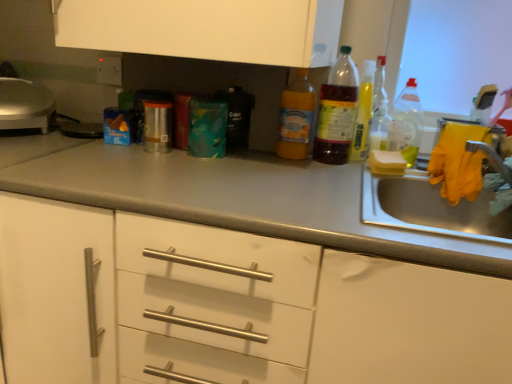
Describe the element at coordinates (362, 113) in the screenshot. This screenshot has height=384, width=512. I see `translucent plastic bottle at upper right, the third bottle in the left-to-right sequence` at that location.

I want to click on translucent plastic bottle at upper right, arranged as the third bottle when viewed from the right, so click(x=362, y=113).

This screenshot has width=512, height=384. Describe the element at coordinates (386, 163) in the screenshot. I see `white sponge at sink` at that location.

This screenshot has width=512, height=384. I want to click on gray matte countertop at center, so click(x=231, y=197).

What do you see at coordinates (25, 105) in the screenshot?
I see `shiny silver waffle maker at left` at bounding box center [25, 105].

What do you see at coordinates (379, 125) in the screenshot?
I see `translucent plastic bottle at right, the fourth bottle positioned from the left` at bounding box center [379, 125].

What is the approximate height of translucent plastic bottle at center, the 5th bottle in the right-to-left sequence?

translucent plastic bottle at center, the 5th bottle in the right-to-left sequence, is 9.66 inches tall.

This screenshot has height=384, width=512. Describe the element at coordinates (296, 118) in the screenshot. I see `translucent plastic bottle at center, placed as the 1th bottle when sorted from left to right` at that location.

How much space does translucent plastic bottle at center, the 2th bottle in the left-to-right sequence, occupy horizontally?

The width of translucent plastic bottle at center, the 2th bottle in the left-to-right sequence, is 7.12 centimeters.

This screenshot has height=384, width=512. In order to click on translucent plastic bottle at right, which is the 5th bottle from left to right in this screenshot , I will do `click(406, 124)`.

Does translucent plastic bottle at center, the 2th bottle in the left-to-right sequence, have a lesser width compared to shiny silver waffle maker at left?

Correct, the width of translucent plastic bottle at center, the 2th bottle in the left-to-right sequence, is less than that of shiny silver waffle maker at left.

Is point (315, 158) closer or farther from the camera than point (44, 124)?

Clearly, point (315, 158) is closer to the camera than point (44, 124).

Who is smaller, translucent plastic bottle at center, the 2th bottle in the left-to-right sequence, or shiny silver waffle maker at left?

Smaller between the two is translucent plastic bottle at center, the 2th bottle in the left-to-right sequence.

The width and height of the screenshot is (512, 384). Identify the location of appliance that is behind the translucent plastic bottle at center, which ranks as the fourth bottle in right-to-left order. (25, 105).

You are a GUI agent. You are given a task and a screenshot of the screen. Output one action in this format:
    pyautogui.click(x=<x>, y=<y>)
    Task: Click on the 3rd bottle counting from the right side of the translucent plastic bottle at center, which ranks as the fourth bottle in right-to-left order
    
    Given the screenshot: What is the action you would take?
    (x=406, y=124)

Is translucent plastic bottle at center, which ranks as the fourth bottle in right-to-left order, at the right side of translucent plastic bottle at right, positioned as the 1th bottle in right-to-left order?

Incorrect, translucent plastic bottle at center, which ranks as the fourth bottle in right-to-left order, is not on the right side of translucent plastic bottle at right, positioned as the 1th bottle in right-to-left order.

Is point (344, 128) farther from camera compared to point (392, 125)?

No, it is in front of (392, 125).

Measure the distance from translucent plastic bottle at center, which ranks as the fourth bottle in right-to-left order, to translucent plastic bottle at right, which is the 5th bottle from left to right.

The distance of translucent plastic bottle at center, which ranks as the fourth bottle in right-to-left order, from translucent plastic bottle at right, which is the 5th bottle from left to right, is 8.04 inches.

Is gray matte countertop at center beside translucent plastic bottle at right, the second bottle from the right?

gray matte countertop at center and translucent plastic bottle at right, the second bottle from the right, are not in contact.

Can you tell me how much gray matte countertop at center and translucent plastic bottle at right, the second bottle from the right, differ in facing direction?

There is a 0.92-degree angle between the facing directions of gray matte countertop at center and translucent plastic bottle at right, the second bottle from the right.

Does gray matte countertop at center appear on the right side of translucent plastic bottle at right, the second bottle from the right?

Incorrect, gray matte countertop at center is not on the right side of translucent plastic bottle at right, the second bottle from the right.

Which of these two, gray matte countertop at center or translucent plastic bottle at right, the second bottle from the right, is thinner?

translucent plastic bottle at right, the second bottle from the right.

From a real-world perspective, is translucent plastic bottle at center, the 5th bottle in the right-to-left sequence, above or below shiny silver waffle maker at left?

translucent plastic bottle at center, the 5th bottle in the right-to-left sequence, is above shiny silver waffle maker at left.

Considering the sizes of objects translucent plastic bottle at center, the 5th bottle in the right-to-left sequence, and shiny silver waffle maker at left in the image provided, who is bigger, translucent plastic bottle at center, the 5th bottle in the right-to-left sequence, or shiny silver waffle maker at left?

With larger size is shiny silver waffle maker at left.

In the scene shown: Can you tell me how much translucent plastic bottle at center, the 5th bottle in the right-to-left sequence, and shiny silver waffle maker at left differ in facing direction?

They differ by 55.9 degrees in their facing directions.

Is translucent plastic bottle at center, placed as the 1th bottle when sorted from left to right, at the left side of translucent plastic bottle at right, the second bottle from the right?

Yes, translucent plastic bottle at center, placed as the 1th bottle when sorted from left to right, is to the left of translucent plastic bottle at right, the second bottle from the right.

Would you say translucent plastic bottle at center, the 5th bottle in the right-to-left sequence, is outside translucent plastic bottle at right, the fourth bottle positioned from the left?

That's correct, translucent plastic bottle at center, the 5th bottle in the right-to-left sequence, is outside of translucent plastic bottle at right, the fourth bottle positioned from the left.

Between translucent plastic bottle at center, the 5th bottle in the right-to-left sequence, and translucent plastic bottle at right, the fourth bottle positioned from the left, which one has smaller width?

Thinner between the two is translucent plastic bottle at center, the 5th bottle in the right-to-left sequence.

Measure the distance between translucent plastic bottle at center, the 5th bottle in the right-to-left sequence, and translucent plastic bottle at right, the second bottle from the right.

A distance of 9.13 inches exists between translucent plastic bottle at center, the 5th bottle in the right-to-left sequence, and translucent plastic bottle at right, the second bottle from the right.

Can you confirm if shiny silver waffle maker at left is positioned to the left of translucent plastic bottle at upper right, the third bottle in the left-to-right sequence?

Yes, shiny silver waffle maker at left is to the left of translucent plastic bottle at upper right, the third bottle in the left-to-right sequence.

Considering the sizes of objects shiny silver waffle maker at left and translucent plastic bottle at upper right, the third bottle in the left-to-right sequence, in the image provided, who is thinner, shiny silver waffle maker at left or translucent plastic bottle at upper right, the third bottle in the left-to-right sequence,?

translucent plastic bottle at upper right, the third bottle in the left-to-right sequence, is thinner.

Is shiny silver waffle maker at left far away from translucent plastic bottle at upper right, arranged as the third bottle when viewed from the right?

No, shiny silver waffle maker at left is not far from translucent plastic bottle at upper right, arranged as the third bottle when viewed from the right.

Considering the relative sizes of shiny silver waffle maker at left and translucent plastic bottle at upper right, arranged as the third bottle when viewed from the right, in the image provided, is shiny silver waffle maker at left taller than translucent plastic bottle at upper right, arranged as the third bottle when viewed from the right,?

No.

Is white sponge at sink outside of translucent plastic bottle at center, the 2th bottle in the left-to-right sequence?

Absolutely, white sponge at sink is external to translucent plastic bottle at center, the 2th bottle in the left-to-right sequence.

Are white sponge at sink and translucent plastic bottle at center, which ranks as the fourth bottle in right-to-left order, far apart?

white sponge at sink is near translucent plastic bottle at center, which ranks as the fourth bottle in right-to-left order, not far away.

Considering the positions of objects white sponge at sink and translucent plastic bottle at center, the 2th bottle in the left-to-right sequence, in the image provided, who is more to the left, white sponge at sink or translucent plastic bottle at center, the 2th bottle in the left-to-right sequence,?

From the viewer's perspective, translucent plastic bottle at center, the 2th bottle in the left-to-right sequence, appears more on the left side.

The image size is (512, 384). In order to click on appliance that appears above the translucent plastic bottle at center, the 2th bottle in the left-to-right sequence (from the image's perspective) in this screenshot , I will do `click(25, 105)`.

In order to click on bottle that is the 2nd object above the translucent plastic bottle at right, which is the 5th bottle from left to right (from a real-world perspective) in this screenshot , I will do `click(337, 111)`.

Estimate the real-world distances between objects in this image. Which object is closer to translucent plastic bottle at center, the 5th bottle in the right-to-left sequence, translucent plastic bottle at right, which is the 5th bottle from left to right, or gray matte countertop at center?

translucent plastic bottle at right, which is the 5th bottle from left to right, is positioned closer to the anchor translucent plastic bottle at center, the 5th bottle in the right-to-left sequence.

Based on the photo, estimate the real-world distances between objects in this image. Which object is closer to white sponge at sink, translucent plastic bottle at center, the 2th bottle in the left-to-right sequence, or translucent plastic bottle at upper right, the third bottle in the left-to-right sequence?

translucent plastic bottle at upper right, the third bottle in the left-to-right sequence, lies closer to white sponge at sink than the other object.

Considering their positions, is shiny silver waffle maker at left positioned further to gray matte countertop at center than translucent plastic bottle at center, placed as the 1th bottle when sorted from left to right?

Among the two, shiny silver waffle maker at left is located further to gray matte countertop at center.

Based on their spatial positions, is translucent plastic bottle at center, the 5th bottle in the right-to-left sequence, or translucent plastic bottle at right, positioned as the 1th bottle in right-to-left order, further from gray matte countertop at center?

translucent plastic bottle at right, positioned as the 1th bottle in right-to-left order.

From the image, which object appears to be farther from translucent plastic bottle at center, which ranks as the fourth bottle in right-to-left order, gray matte countertop at center or translucent plastic bottle at upper right, the third bottle in the left-to-right sequence?

Among the two, gray matte countertop at center is located further to translucent plastic bottle at center, which ranks as the fourth bottle in right-to-left order.

Estimate the real-world distances between objects in this image. Which object is further from translucent plastic bottle at center, the 5th bottle in the right-to-left sequence, gray matte countertop at center or white sponge at sink?

Among the two, gray matte countertop at center is located further to translucent plastic bottle at center, the 5th bottle in the right-to-left sequence.

From the image, which object appears to be nearer to translucent plastic bottle at upper right, the third bottle in the left-to-right sequence, white sponge at sink or shiny silver waffle maker at left?

white sponge at sink lies closer to translucent plastic bottle at upper right, the third bottle in the left-to-right sequence, than the other object.

When comparing their distances from gray matte countertop at center, does shiny silver waffle maker at left or translucent plastic bottle at right, the second bottle from the right, seem closer?

The object closer to gray matte countertop at center is shiny silver waffle maker at left.

In order to click on countertop between shiny silver waffle maker at left and translucent plastic bottle at right, the second bottle from the right, in the horizontal direction in this screenshot , I will do `click(231, 197)`.

This screenshot has width=512, height=384. I want to click on countertop situated between shiny silver waffle maker at left and translucent plastic bottle at upper right, arranged as the third bottle when viewed from the right, from left to right, so click(x=231, y=197).

Find the location of a particular element. This screenshot has width=512, height=384. bottle located between translucent plastic bottle at center, placed as the 1th bottle when sorted from left to right, and translucent plastic bottle at upper right, arranged as the third bottle when viewed from the right, in the left-right direction is located at coordinates (337, 111).

You are a GUI agent. You are given a task and a screenshot of the screen. Output one action in this format:
    pyautogui.click(x=<x>, y=<y>)
    Task: Click on the countertop located between shiny silver waffle maker at left and translucent plastic bottle at right, which is the 5th bottle from left to right, in the left-right direction
    
    Given the screenshot: What is the action you would take?
    pyautogui.click(x=231, y=197)